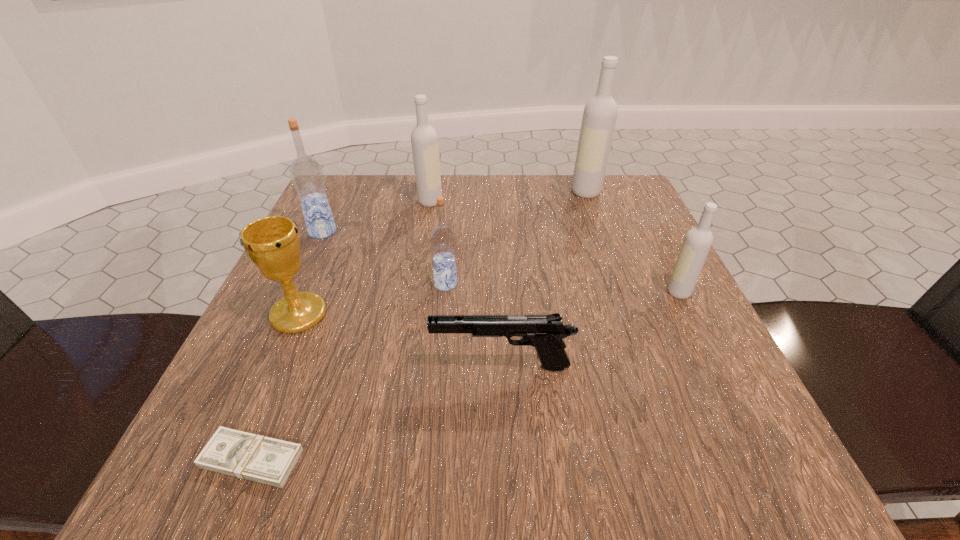
Locate an element on the screen. free space between the left blue vodka and the chalice is located at coordinates (311, 273).

Find the location of `vacant space in between the tallest vodka and the leftmost white vodka`. vacant space in between the tallest vodka and the leftmost white vodka is located at coordinates (508, 197).

Find the location of `free space that is in between the farther blue vodka and the second white vodka from left to right`. free space that is in between the farther blue vodka and the second white vodka from left to right is located at coordinates (454, 212).

Locate an element on the screen. This screenshot has width=960, height=540. free space between the second nearest object and the nearest object is located at coordinates point(377,413).

At what (x,y) coordinates should I click in order to perform the action: click on free point between the money and the leftmost vodka. Please return your answer as a coordinate pair (x, y). This screenshot has height=540, width=960. Looking at the image, I should click on (287, 345).

Find the location of `free space that is in between the fourth vodka from right to left and the second shortest object`. free space that is in between the fourth vodka from right to left and the second shortest object is located at coordinates (466, 284).

Locate an element on the screen. vacant space in between the leftmost vodka and the right blue vodka is located at coordinates (384, 258).

This screenshot has width=960, height=540. In order to click on free space between the money and the fourth vodka from right to left in this screenshot , I will do `click(341, 330)`.

The height and width of the screenshot is (540, 960). Find the location of `object that stands as the closest to the money`. object that stands as the closest to the money is located at coordinates (272, 243).

At what (x,y) coordinates should I click in order to perform the action: click on object that can be found as the third closest to the money. Please return your answer as a coordinate pair (x, y). The width and height of the screenshot is (960, 540). Looking at the image, I should click on (442, 237).